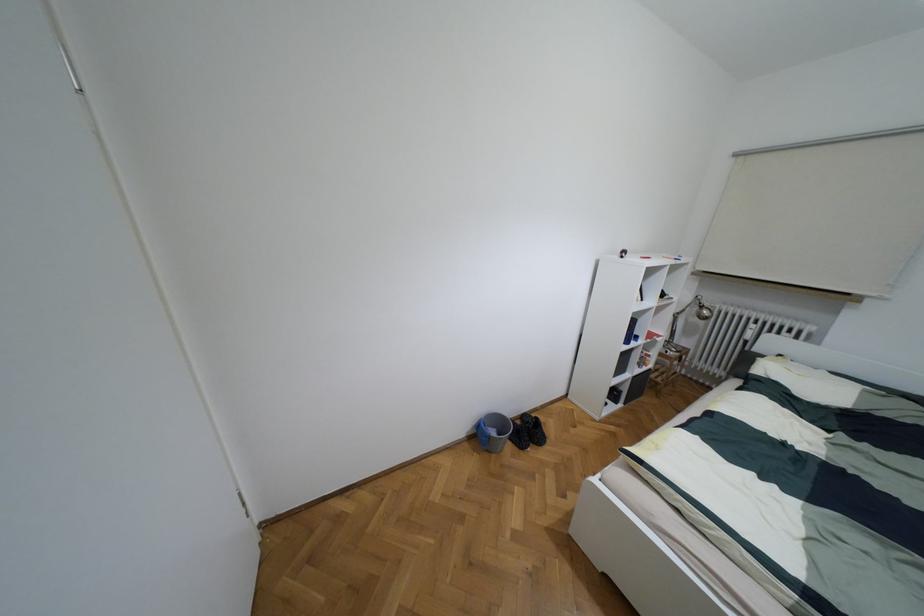
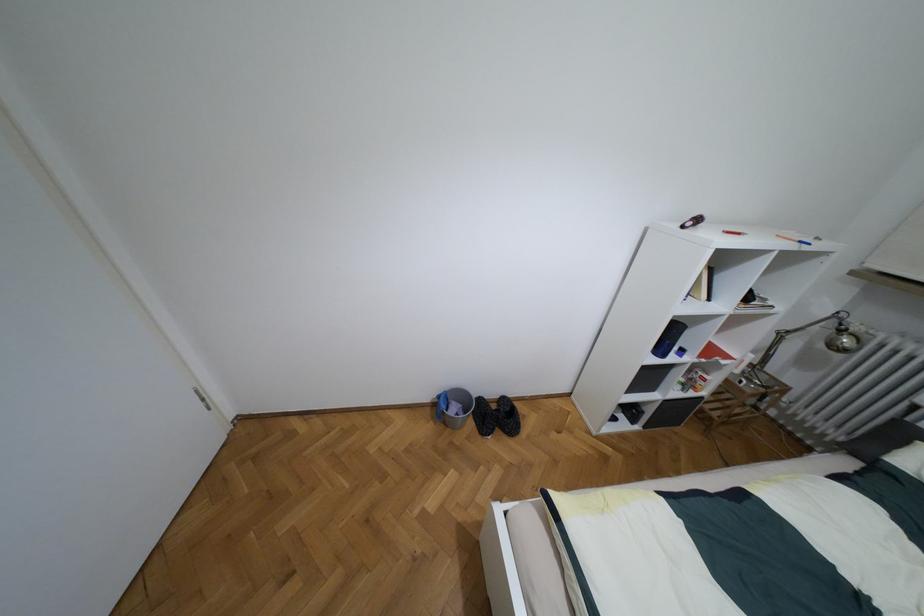
In the second image, find the point that corresponds to point (699, 306) in the first image.

(840, 330)